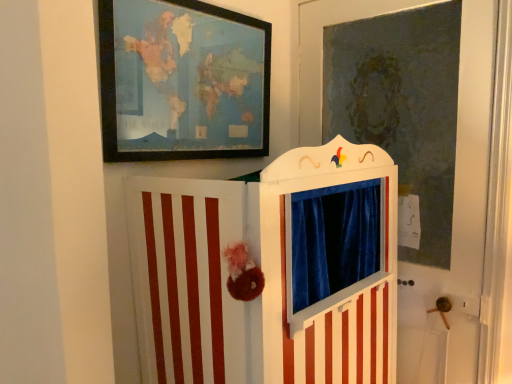
Identify the location of white striped puppet theater at center. The width and height of the screenshot is (512, 384). (268, 272).

What is the approximate height of white striped puppet theater at center?

white striped puppet theater at center is 1.25 meters in height.

Describe the element at coordinates (456, 224) in the screenshot. I see `velvet blue curtain at upper center` at that location.

The height and width of the screenshot is (384, 512). Find the location of `wooden framed map at upper left`. wooden framed map at upper left is located at coordinates (182, 81).

Looking at this image, are velvet blue curtain at upper center and white striped puppet theater at center located far from each other?

No, velvet blue curtain at upper center is not far from white striped puppet theater at center.

Considering the relative sizes of velvet blue curtain at upper center and white striped puppet theater at center in the image provided, is velvet blue curtain at upper center shorter than white striped puppet theater at center?

Incorrect, the height of velvet blue curtain at upper center does not fall short of that of white striped puppet theater at center.

Measure the distance between velvet blue curtain at upper center and white striped puppet theater at center.

22.66 inches.

Is velvet blue curtain at upper center bigger than white striped puppet theater at center?

Incorrect, velvet blue curtain at upper center is not larger than white striped puppet theater at center.

Does point (344, 359) appear closer or farther from the camera than point (190, 58)?

Clearly, point (344, 359) is closer to the camera than point (190, 58).

Considering the positions of objects white striped puppet theater at center and wooden framed map at upper left in the image provided, who is more to the right, white striped puppet theater at center or wooden framed map at upper left?

From the viewer's perspective, white striped puppet theater at center appears more on the right side.

Would you consider white striped puppet theater at center to be distant from wooden framed map at upper left?

No, white striped puppet theater at center is not far away from wooden framed map at upper left.

What are the coordinates of `furniture in front of the wooden framed map at upper left` in the screenshot? It's located at (268, 272).

From a real-world perspective, which object stands above the other?

wooden framed map at upper left is physically above.

Is wooden framed map at upper left oriented towards velvet blue curtain at upper center?

No, wooden framed map at upper left is not oriented towards velvet blue curtain at upper center.

Which of these two, wooden framed map at upper left or velvet blue curtain at upper center, stands taller?

With more height is velvet blue curtain at upper center.

Considering the relative positions of white striped puppet theater at center and velvet blue curtain at upper center in the image provided, is white striped puppet theater at center to the right of velvet blue curtain at upper center from the viewer's perspective?

No.

From a real-world perspective, relative to velvet blue curtain at upper center, is white striped puppet theater at center vertically above or below?

white striped puppet theater at center is below velvet blue curtain at upper center.

Between white striped puppet theater at center and velvet blue curtain at upper center, which one has smaller width?

velvet blue curtain at upper center.

Considering the sizes of objects wooden framed map at upper left and white striped puppet theater at center in the image provided, who is thinner, wooden framed map at upper left or white striped puppet theater at center?

wooden framed map at upper left is thinner.

Find the location of a particular element. The height and width of the screenshot is (384, 512). furniture below the wooden framed map at upper left (from the image's perspective) is located at coordinates (268, 272).

From the image's perspective, is wooden framed map at upper left located above or below white striped puppet theater at center?

wooden framed map at upper left is situated higher than white striped puppet theater at center in the image.

Which is more to the left, wooden framed map at upper left or white striped puppet theater at center?

wooden framed map at upper left is more to the left.

Is velvet blue curtain at upper center placed right next to wooden framed map at upper left?

No.

Does velvet blue curtain at upper center turn towards wooden framed map at upper left?

Yes, velvet blue curtain at upper center is aimed at wooden framed map at upper left.

Based on their positions, is velvet blue curtain at upper center located to the left or right of wooden framed map at upper left?

velvet blue curtain at upper center is to the right of wooden framed map at upper left.

This screenshot has width=512, height=384. Find the location of `picture frame above the velvet blue curtain at upper center (from a real-world perspective)`. picture frame above the velvet blue curtain at upper center (from a real-world perspective) is located at coordinates (182, 81).

Find the location of a particular element. The image size is (512, 384). furniture located below the velvet blue curtain at upper center (from the image's perspective) is located at coordinates (268, 272).

You are a GUI agent. You are given a task and a screenshot of the screen. Output one action in this format:
    pyautogui.click(x=<x>, y=<y>)
    Task: Click on the picture frame behind the white striped puppet theater at center
    This screenshot has width=512, height=384.
    Given the screenshot: What is the action you would take?
    pyautogui.click(x=182, y=81)

Based on their spatial positions, is white striped puppet theater at center or wooden framed map at upper left closer to velvet blue curtain at upper center?

white striped puppet theater at center lies closer to velvet blue curtain at upper center than the other object.

Based on their spatial positions, is white striped puppet theater at center or velvet blue curtain at upper center closer to wooden framed map at upper left?

white striped puppet theater at center is closer to wooden framed map at upper left.

Which object lies further to the anchor point velvet blue curtain at upper center, wooden framed map at upper left or white striped puppet theater at center?

Based on the image, wooden framed map at upper left appears to be further to velvet blue curtain at upper center.

Consider the image. Looking at the image, which one is located closer to white striped puppet theater at center, velvet blue curtain at upper center or wooden framed map at upper left?

wooden framed map at upper left is closer to white striped puppet theater at center.

Which object lies nearer to the anchor point white striped puppet theater at center, wooden framed map at upper left or velvet blue curtain at upper center?

wooden framed map at upper left is positioned closer to the anchor white striped puppet theater at center.

Which object lies further to the anchor point wooden framed map at upper left, velvet blue curtain at upper center or white striped puppet theater at center?

Among the two, velvet blue curtain at upper center is located further to wooden framed map at upper left.

Locate an element on the screen. The height and width of the screenshot is (384, 512). door between wooden framed map at upper left and white striped puppet theater at center in the up-down direction is located at coordinates (456, 224).